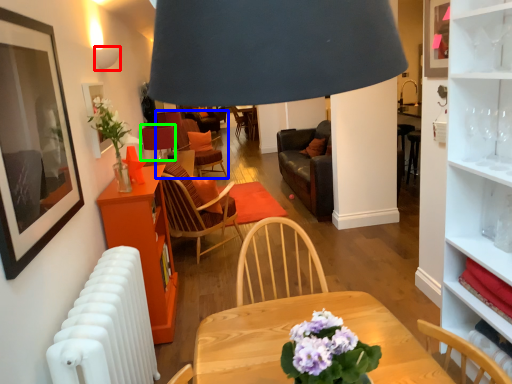
Question: Based on their relative distances, which object is nearer to lamp (highlighted by a red box)? Choose from chair (highlighted by a blue box) and table lamp (highlighted by a green box).

Choices:
 (A) chair
 (B) table lamp

Answer: (B)